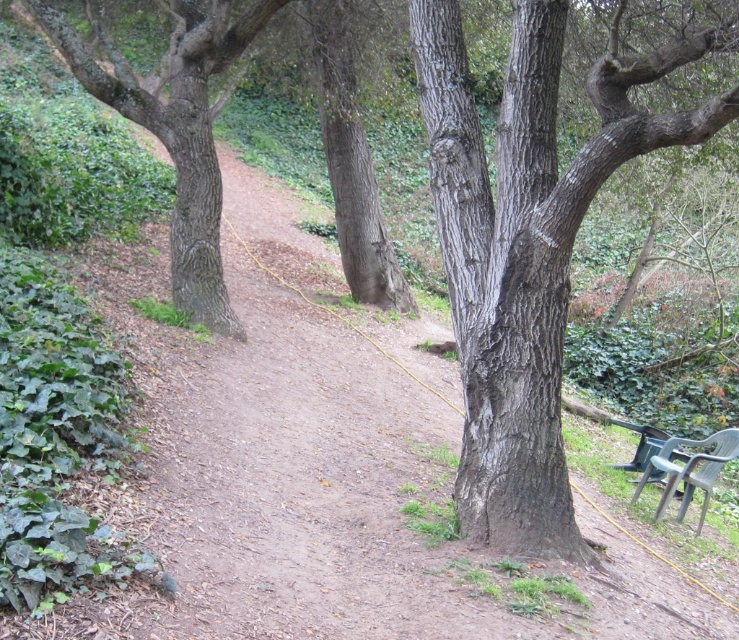
From the picture: You are standing at the starting point of the dirt path and want to find the smooth gray bark tree at center. According to the coordinates provided, where should you look relative to your position?

The smooth gray bark tree at center is located at coordinates point (x=527, y=246), which means it is positioned to the lower right of your current position along the dirt path.